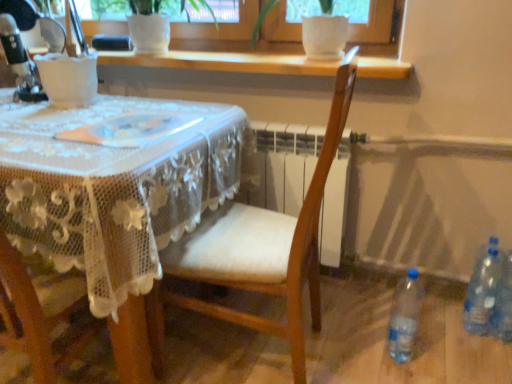
Where is `vacant space that is in between transparent plastic bottle at lower right, the 1th bottle in the left-to-right sequence, and clear plastic bottle at lower right, the third bottle when ordered from left to right`? vacant space that is in between transparent plastic bottle at lower right, the 1th bottle in the left-to-right sequence, and clear plastic bottle at lower right, the third bottle when ordered from left to right is located at coordinates (448, 347).